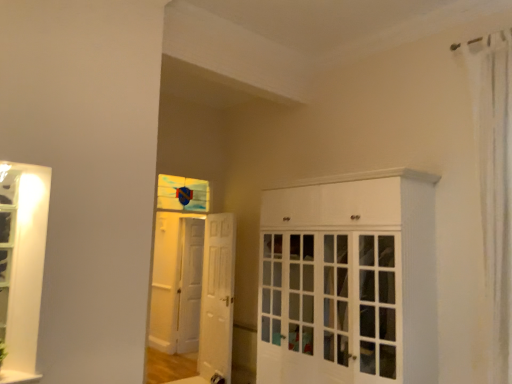
Question: Is white glossy cabinet at center bigger than stained glass window at center?

Choices:
 (A) yes
 (B) no

Answer: (A)

Question: Is white glossy cabinet at center at the right side of stained glass window at center?

Choices:
 (A) yes
 (B) no

Answer: (A)

Question: Is white glossy cabinet at center positioned with its back to stained glass window at center?

Choices:
 (A) yes
 (B) no

Answer: (B)

Question: Considering the relative positions of white glossy cabinet at center and stained glass window at center in the image provided, is white glossy cabinet at center behind stained glass window at center?

Choices:
 (A) yes
 (B) no

Answer: (B)

Question: Can you confirm if white glossy cabinet at center is smaller than stained glass window at center?

Choices:
 (A) no
 (B) yes

Answer: (A)

Question: From the image's perspective, is white glossy cabinet at center on stained glass window at center?

Choices:
 (A) no
 (B) yes

Answer: (A)

Question: Can you confirm if white wooden door at center, the 2th door when ordered from left to right, is thinner than stained glass window at center?

Choices:
 (A) yes
 (B) no

Answer: (B)

Question: Is white wooden door at center, which appears as the 1th door when viewed from the front, shorter than stained glass window at center?

Choices:
 (A) no
 (B) yes

Answer: (A)

Question: Is white wooden door at center, which appears as the 1th door when viewed from the front, aimed at stained glass window at center?

Choices:
 (A) yes
 (B) no

Answer: (B)

Question: From a real-world perspective, is white wooden door at center, which appears as the 1th door when viewed from the front, below stained glass window at center?

Choices:
 (A) no
 (B) yes

Answer: (B)

Question: Does white wooden door at center, the first door from the right, appear on the right side of stained glass window at center?

Choices:
 (A) no
 (B) yes

Answer: (B)

Question: Is white wooden door at center, the 2th door viewed from the back, at the left side of stained glass window at center?

Choices:
 (A) yes
 (B) no

Answer: (B)

Question: Can you confirm if white sheer curtain at right is wider than white wooden door at center, the 2th door when ordered from left to right?

Choices:
 (A) no
 (B) yes

Answer: (B)